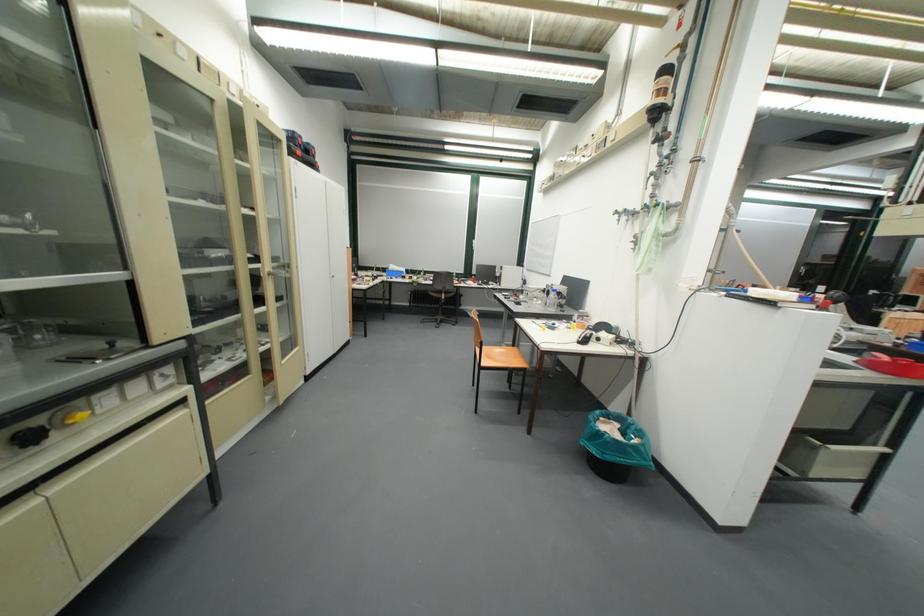
Describe the element at coordinates (502, 357) in the screenshot. I see `the orange chair surface` at that location.